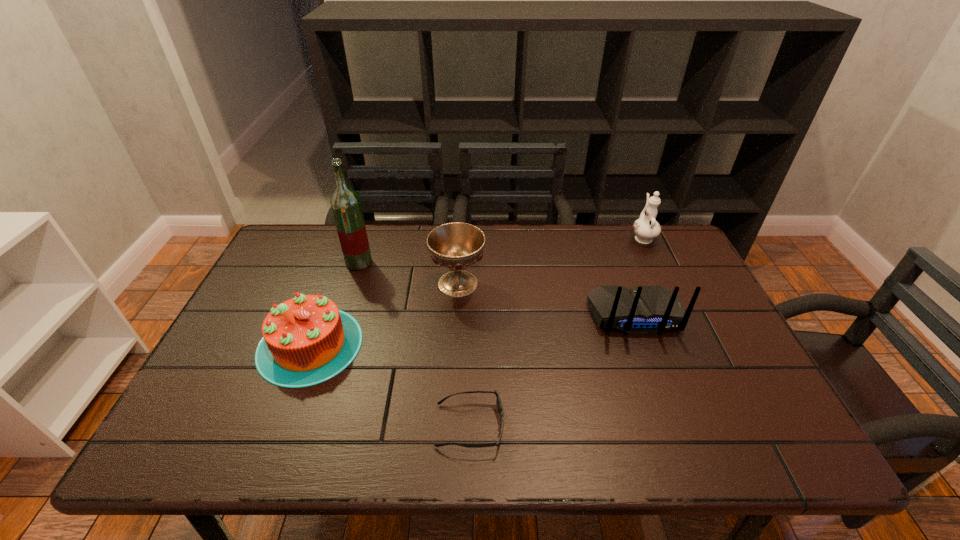
At what (x,y) coordinates should I click in order to perform the action: click on free area in between the sunglasses and the cake. Please return your answer as a coordinate pair (x, y). This screenshot has height=540, width=960. Looking at the image, I should click on (390, 385).

The width and height of the screenshot is (960, 540). I want to click on unoccupied position between the chinaware and the shortest object, so click(x=556, y=331).

Locate an element on the screen. This screenshot has height=540, width=960. free area in between the sunglasses and the tallest object is located at coordinates (415, 344).

Identify the location of vacant area between the chinaware and the liquor. This screenshot has height=540, width=960. (501, 249).

Find the location of a particular element. Image resolution: width=960 pixels, height=540 pixels. blank region between the cake and the chalice is located at coordinates (384, 314).

This screenshot has height=540, width=960. What are the coordinates of `object that is the third closest to the tallest object` in the screenshot? It's located at (498, 401).

Locate which object is the closest to the cake. Please provide its 2D coordinates. Your answer should be formatted as a tuple, i.e. [(x, y)], where the tuple contains the x and y coordinates of a point satisfying the conditions above.

[(456, 246)]

Where is `vacant region that satisfies the following two spatial constraints: 1. on the back of the router; 2. on the front-facing side of the sunglasses`? This screenshot has height=540, width=960. vacant region that satisfies the following two spatial constraints: 1. on the back of the router; 2. on the front-facing side of the sunglasses is located at coordinates (676, 426).

Locate an element on the screen. vacant space that satisfies the following two spatial constraints: 1. on the back of the router; 2. on the front-facing side of the nearest object is located at coordinates (676, 426).